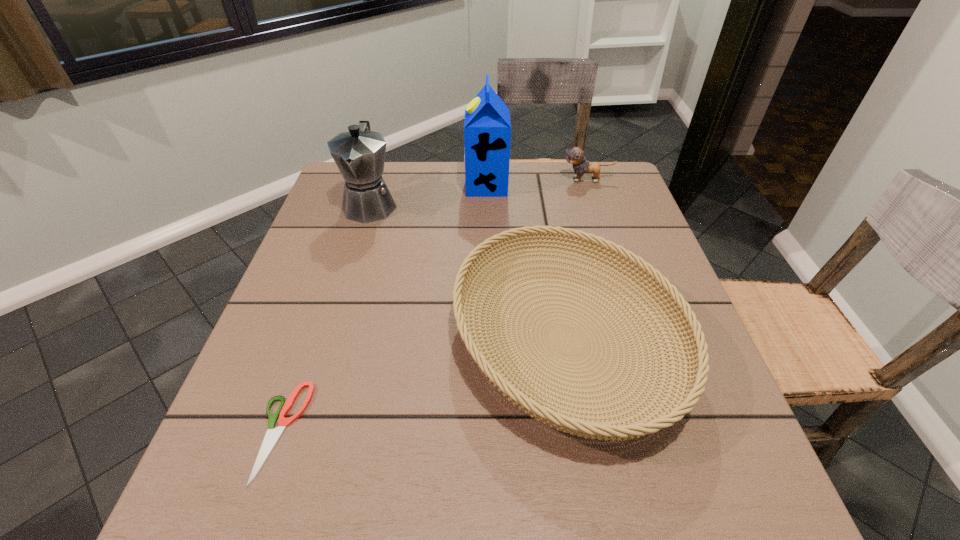
Locate an element on the screen. The image size is (960, 540). vacant space at the far right corner is located at coordinates (636, 207).

Where is `blank space at the near right corner of the desktop`? The height and width of the screenshot is (540, 960). blank space at the near right corner of the desktop is located at coordinates (700, 485).

Find the location of a particular element. Image resolution: width=960 pixels, height=540 pixels. vacant space that's between the shortest object and the carton is located at coordinates (384, 308).

At what (x,y) coordinates should I click in order to perform the action: click on free space between the carton and the coffeepot. Please return your answer as a coordinate pair (x, y). The width and height of the screenshot is (960, 540). Looking at the image, I should click on (428, 195).

Image resolution: width=960 pixels, height=540 pixels. Identify the location of free spot between the shortest object and the coffeepot. (325, 318).

Find the location of a particular element. vacant area that lies between the kitten and the tallest object is located at coordinates (537, 183).

Image resolution: width=960 pixels, height=540 pixels. Find the location of `empty space between the scissors and the kitten`. empty space between the scissors and the kitten is located at coordinates (434, 306).

Locate an element on the screen. The height and width of the screenshot is (540, 960). vacant point located between the basket and the kitten is located at coordinates (576, 260).

The image size is (960, 540). I want to click on empty space that is in between the coffeepot and the carton, so click(428, 195).

In order to click on object identified as the third closest to the basket in this screenshot , I will do `click(487, 128)`.